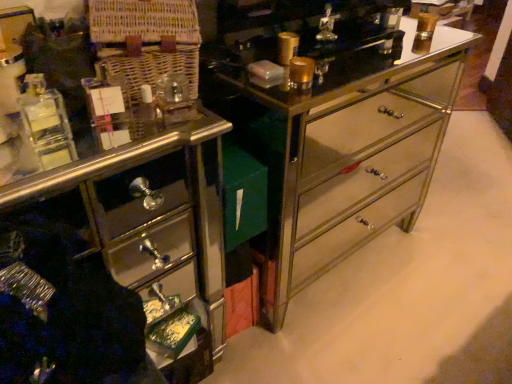
The width and height of the screenshot is (512, 384). What are the coordinates of `vacant space in front of metallic mirrored dresser at center` in the screenshot? It's located at (362, 340).